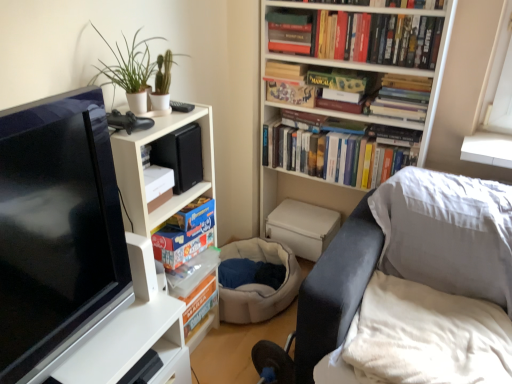
Question: Is hardcover book at upper center, which is counted as the 2th book, starting from the top, bigger than hardcover books at upper center, which is counted as the 4th book, starting from the top?

Choices:
 (A) yes
 (B) no

Answer: (A)

Question: Are hardcover book at upper center, acting as the 5th book starting from the bottom, and hardcover books at upper center, which is counted as the 4th book, starting from the top, beside each other?

Choices:
 (A) no
 (B) yes

Answer: (A)

Question: From the image's perspective, is hardcover book at upper center, acting as the 5th book starting from the bottom, under hardcover books at upper center, which is counted as the 4th book, starting from the top?

Choices:
 (A) no
 (B) yes

Answer: (A)

Question: Does hardcover book at upper center, acting as the 5th book starting from the bottom, have a greater width compared to hardcover books at upper center, the third book in the bottom-to-top sequence?

Choices:
 (A) no
 (B) yes

Answer: (A)

Question: Is the depth of hardcover book at upper center, acting as the 5th book starting from the bottom, greater than that of hardcover books at upper center, the third book in the bottom-to-top sequence?

Choices:
 (A) no
 (B) yes

Answer: (A)

Question: Considering the positions of matte black tv at left and green matte plant at upper left in the image, is matte black tv at left bigger or smaller than green matte plant at upper left?

Choices:
 (A) big
 (B) small

Answer: (A)

Question: Is matte black tv at left wider or thinner than green matte plant at upper left?

Choices:
 (A) thin
 (B) wide

Answer: (A)

Question: From a real-world perspective, relative to green matte plant at upper left, is matte black tv at left vertically above or below?

Choices:
 (A) below
 (B) above

Answer: (A)

Question: Choose the correct answer: Is matte black tv at left inside green matte plant at upper left or outside it?

Choices:
 (A) outside
 (B) inside

Answer: (A)

Question: Would you say white matte bookcase at upper center, which is counted as the second bookcase, starting from the left, is to the left or to the right of matte black tv at left in the picture?

Choices:
 (A) left
 (B) right

Answer: (B)

Question: In the image, is white matte bookcase at upper center, arranged as the first bookcase when viewed from the right, positioned in front of or behind matte black tv at left?

Choices:
 (A) behind
 (B) front

Answer: (A)

Question: Is point (276, 200) closer or farther from the camera than point (25, 301)?

Choices:
 (A) farther
 (B) closer

Answer: (A)

Question: Considering the positions of white matte bookcase at upper center, arranged as the first bookcase when viewed from the right, and matte black tv at left in the image, is white matte bookcase at upper center, arranged as the first bookcase when viewed from the right, bigger or smaller than matte black tv at left?

Choices:
 (A) small
 (B) big

Answer: (B)

Question: In terms of size, does green matte plant at upper left appear bigger or smaller than matte black tv at left?

Choices:
 (A) small
 (B) big

Answer: (A)

Question: Does point (146, 61) appear closer or farther from the camera than point (57, 125)?

Choices:
 (A) farther
 (B) closer

Answer: (A)